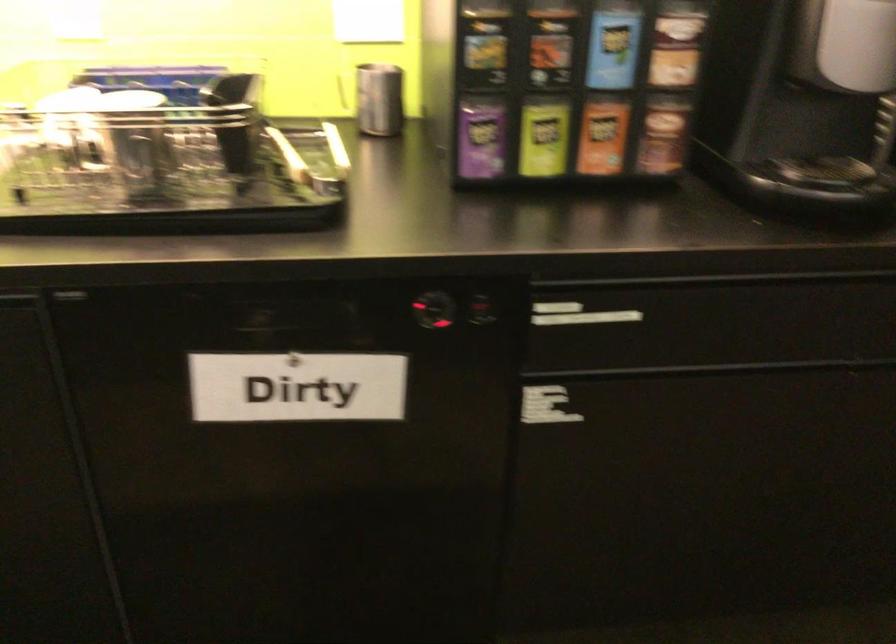
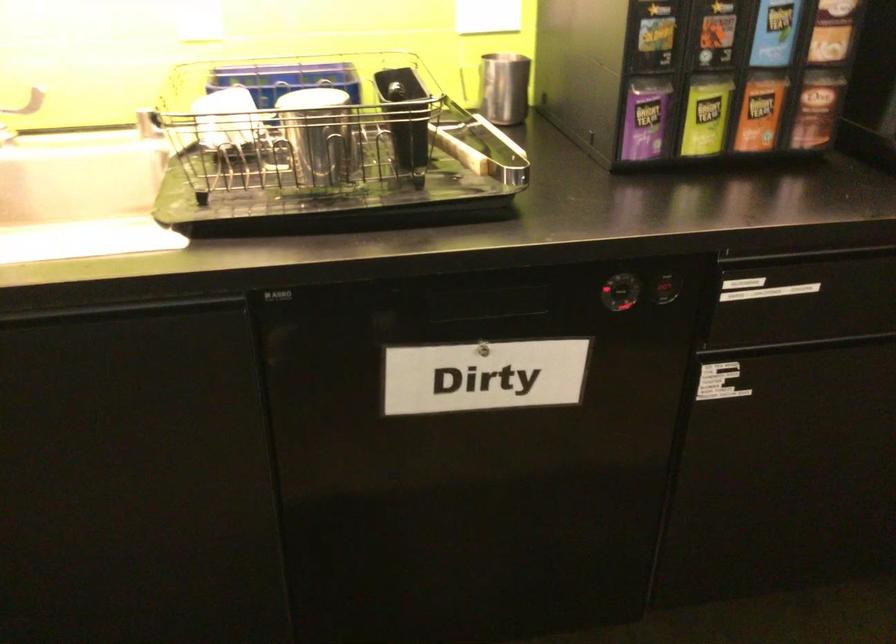
Where in the second image is the point corresponding to pixel 375 100 from the first image?

(504, 88)